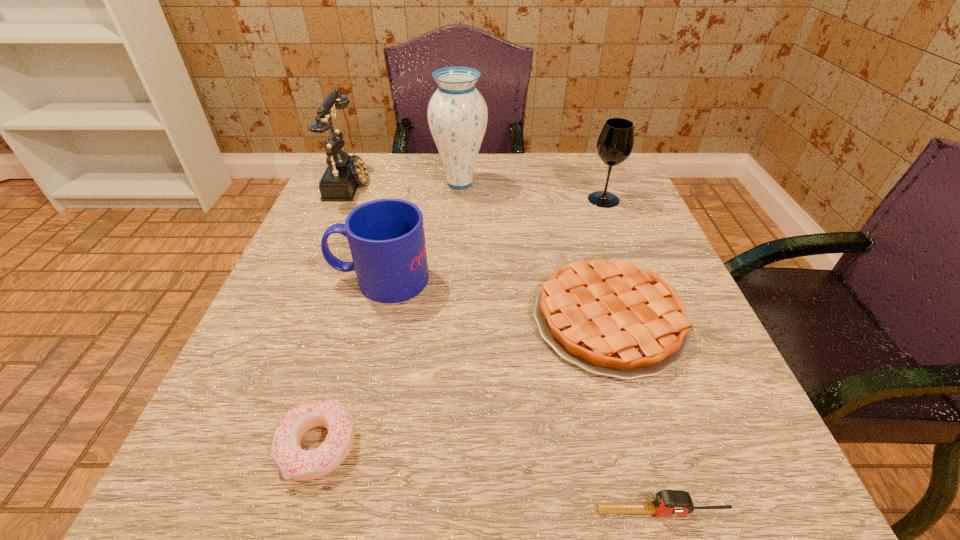
Image resolution: width=960 pixels, height=540 pixels. I want to click on vacant region that satisfies the following two spatial constraints: 1. on the front side of the second nearest object; 2. on the right side of the nearest object, so click(299, 511).

Where is `vacant position in the image that satisfies the following two spatial constraints: 1. on the dial of the telephone; 2. on the left side of the second nearest object`? The image size is (960, 540). vacant position in the image that satisfies the following two spatial constraints: 1. on the dial of the telephone; 2. on the left side of the second nearest object is located at coordinates (236, 447).